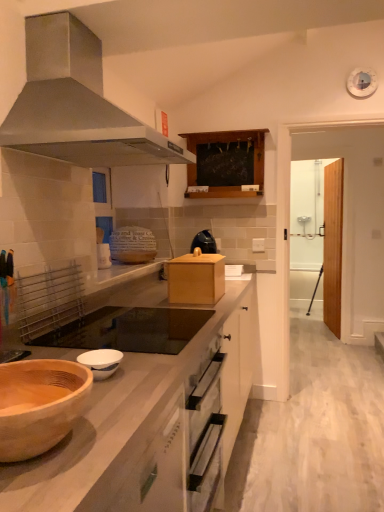
What is the approximate height of transparent glass door at right, the first glass door viewed from the left?

6.48 feet.

Find the location of a particular element. The height and width of the screenshot is (512, 384). wooden at left is located at coordinates (129, 431).

Describe the element at coordinates (77, 104) in the screenshot. I see `metallic stainless steel range hood at upper left` at that location.

This screenshot has width=384, height=512. What do you see at coordinates (129, 330) in the screenshot? I see `black glass gas stove at center` at bounding box center [129, 330].

Measure the distance between point [196,193] and camera.

The depth of point [196,193] is 3.07 meters.

At what (x,y) coordinates should I click in order to perform the action: click on transparent glass door at right, the first glass door viewed from the left. Please return your answer as a coordinate pair (x, y). This screenshot has width=384, height=512. Looking at the image, I should click on (317, 234).

Considering the positions of points (325, 228) and (329, 176), is point (325, 228) closer to camera compared to point (329, 176)?

No, (325, 228) is further to viewer.

Is transparent glass door at right, the 2th glass door positioned from the left, positioned with its back to transparent glass door at right, the 2th glass door viewed from the right?

No, transparent glass door at right, the 2th glass door positioned from the left, is not facing away from transparent glass door at right, the 2th glass door viewed from the right.

From a real-world perspective, who is located higher, transparent glass door at right, the 2th glass door positioned from the left, or transparent glass door at right, the first glass door viewed from the left?

transparent glass door at right, the first glass door viewed from the left, from a real-world perspective.

In the image, is transparent glass door at right, which appears as the first glass door when viewed from the right, positioned in front of or behind transparent glass door at right, the 2th glass door viewed from the right?

In the image, transparent glass door at right, which appears as the first glass door when viewed from the right, appears behind transparent glass door at right, the 2th glass door viewed from the right.

From a real-world perspective, is transparent glass door at right, which appears as the first glass door when viewed from the right, above or below wooden bowl at lower left, the first bowl in the front-to-back sequence?

transparent glass door at right, which appears as the first glass door when viewed from the right, is situated higher than wooden bowl at lower left, the first bowl in the front-to-back sequence, in the real world.

From the image's perspective, which one is positioned higher, transparent glass door at right, the 2th glass door positioned from the left, or wooden bowl at lower left, the first bowl in the front-to-back sequence?

transparent glass door at right, the 2th glass door positioned from the left, from the image's perspective.

Is transparent glass door at right, which appears as the first glass door when viewed from the right, far away from wooden bowl at lower left, the first bowl in the front-to-back sequence?

Yes.

Based on their sizes in the image, would you say transparent glass door at right, the 2th glass door positioned from the left, is bigger or smaller than wooden bowl at lower left, arranged as the second bowl when viewed from the back?

Considering their sizes, transparent glass door at right, the 2th glass door positioned from the left, takes up more space than wooden bowl at lower left, arranged as the second bowl when viewed from the back.

Does point (56, 356) come closer to viewer compared to point (235, 174)?

Yes, it is in front of point (235, 174).

Is wooden at left surrounding wooden cabinet at upper center?

Definitely not — wooden cabinet at upper center is not inside wooden at left.

From a real-world perspective, is wooden at left positioned above or below wooden cabinet at upper center?

In terms of real-world spatial position, wooden at left is below wooden cabinet at upper center.

Who is shorter, wooden at left or wooden cabinet at upper center?

wooden cabinet at upper center is shorter.

Is wooden cabinet at upper center far from white glossy bowl at center, the 2th bowl when ordered from front to back?

Yes.

Is wooden cabinet at upper center taller or shorter than white glossy bowl at center, the 2th bowl when ordered from front to back?

Considering their sizes, wooden cabinet at upper center has more height than white glossy bowl at center, the 2th bowl when ordered from front to back.

Which is more to the right, wooden cabinet at upper center or white glossy bowl at center, the 2th bowl when ordered from front to back?

From the viewer's perspective, wooden cabinet at upper center appears more on the right side.

From a real-world perspective, who is located lower, white glossy bowl at center, the 2th bowl when ordered from front to back, or transparent glass door at right, the first glass door viewed from the left?

white glossy bowl at center, the 2th bowl when ordered from front to back, from a real-world perspective.

Would you say white glossy bowl at center, which is the first bowl from back to front, is outside transparent glass door at right, the first glass door viewed from the left?

That's correct, white glossy bowl at center, which is the first bowl from back to front, is outside of transparent glass door at right, the first glass door viewed from the left.

From the image's perspective, which is above, white glossy bowl at center, which is the first bowl from back to front, or transparent glass door at right, the 2th glass door viewed from the right?

From the image's view, transparent glass door at right, the 2th glass door viewed from the right, is above.

Does white glossy bowl at center, which is the first bowl from back to front, have a greater height compared to transparent glass door at right, the first glass door viewed from the left?

No, white glossy bowl at center, which is the first bowl from back to front, is not taller than transparent glass door at right, the first glass door viewed from the left.

Is transparent glass door at right, the 2th glass door positioned from the left, oriented towards black glass gas stove at center?

No, transparent glass door at right, the 2th glass door positioned from the left, is not aimed at black glass gas stove at center.

Between point (329, 260) and point (83, 318), which one is positioned behind?

The point (329, 260) is more distant.

Is the surface of transparent glass door at right, the 2th glass door positioned from the left, in direct contact with black glass gas stove at center?

No, transparent glass door at right, the 2th glass door positioned from the left, is not making contact with black glass gas stove at center.

Considering the points (77, 339) and (243, 301), which point is in front, point (77, 339) or point (243, 301)?

Positioned in front is point (77, 339).

From a real-world perspective, is black glass gas stove at center physically located above or below wooden at left?

From a real-world perspective, black glass gas stove at center is physically above wooden at left.

Which is more to the left, black glass gas stove at center or wooden at left?

black glass gas stove at center.

In the image, there is a transparent glass door at right, the 2th glass door viewed from the right. Where is `glass door below it (from a real-world perspective)`? This screenshot has width=384, height=512. glass door below it (from a real-world perspective) is located at coordinates (333, 245).

The height and width of the screenshot is (512, 384). I want to click on glass door that is the 1st one above the wooden bowl at lower left, arranged as the second bowl when viewed from the back (from a real-world perspective), so click(x=333, y=245).

Based on their spatial positions, is transparent glass door at right, the 2th glass door positioned from the left, or white glossy bowl at center, which is the first bowl from back to front, further from black glass gas stove at center?

Among the two, transparent glass door at right, the 2th glass door positioned from the left, is located further to black glass gas stove at center.

Looking at this image, considering their positions, is white glossy bowl at center, which is the first bowl from back to front, positioned closer to wooden at left than metallic stainless steel range hood at upper left?

white glossy bowl at center, which is the first bowl from back to front, is closer to wooden at left.

Looking at the image, which one is located closer to transparent glass door at right, the 2th glass door positioned from the left, wooden bowl at lower left, the first bowl in the front-to-back sequence, or wooden at left?

wooden at left lies closer to transparent glass door at right, the 2th glass door positioned from the left, than the other object.

Based on the photo, from the image, which object appears to be nearer to transparent glass door at right, the 2th glass door viewed from the right, metallic stainless steel range hood at upper left or transparent glass door at right, the 2th glass door positioned from the left?

transparent glass door at right, the 2th glass door positioned from the left, lies closer to transparent glass door at right, the 2th glass door viewed from the right, than the other object.

Looking at the image, which one is located further to wooden cabinet at upper center, transparent glass door at right, the 2th glass door viewed from the right, or wooden at left?

transparent glass door at right, the 2th glass door viewed from the right, is positioned further to the anchor wooden cabinet at upper center.

Estimate the real-world distances between objects in this image. Which object is closer to wooden at left, black glass gas stove at center or wooden bowl at lower left, arranged as the second bowl when viewed from the back?

wooden bowl at lower left, arranged as the second bowl when viewed from the back, is closer to wooden at left.

From the image, which object appears to be farther from transparent glass door at right, which appears as the first glass door when viewed from the right, wooden bowl at lower left, the first bowl in the front-to-back sequence, or metallic stainless steel range hood at upper left?

The object further to transparent glass door at right, which appears as the first glass door when viewed from the right, is wooden bowl at lower left, the first bowl in the front-to-back sequence.

Looking at the image, which one is located closer to transparent glass door at right, the 2th glass door viewed from the right, black glass gas stove at center or metallic stainless steel range hood at upper left?

black glass gas stove at center is positioned closer to the anchor transparent glass door at right, the 2th glass door viewed from the right.

Where is `glass door between wooden cabinet at upper center and transparent glass door at right, the 2th glass door positioned from the left, in the front-back direction`? glass door between wooden cabinet at upper center and transparent glass door at right, the 2th glass door positioned from the left, in the front-back direction is located at coordinates (317, 234).

Find the location of `bowl between wooden bowl at lower left, the first bowl in the front-to-back sequence, and black glass gas stove at center in the front-back direction`. bowl between wooden bowl at lower left, the first bowl in the front-to-back sequence, and black glass gas stove at center in the front-back direction is located at coordinates (101, 362).

Where is `gas stove between white glossy bowl at center, the 2th bowl when ordered from front to back, and transparent glass door at right, the first glass door viewed from the left, from front to back`? Image resolution: width=384 pixels, height=512 pixels. gas stove between white glossy bowl at center, the 2th bowl when ordered from front to back, and transparent glass door at right, the first glass door viewed from the left, from front to back is located at coordinates (129, 330).

I want to click on gas stove between wooden bowl at lower left, arranged as the second bowl when viewed from the back, and transparent glass door at right, the first glass door viewed from the left, in the front-back direction, so click(x=129, y=330).